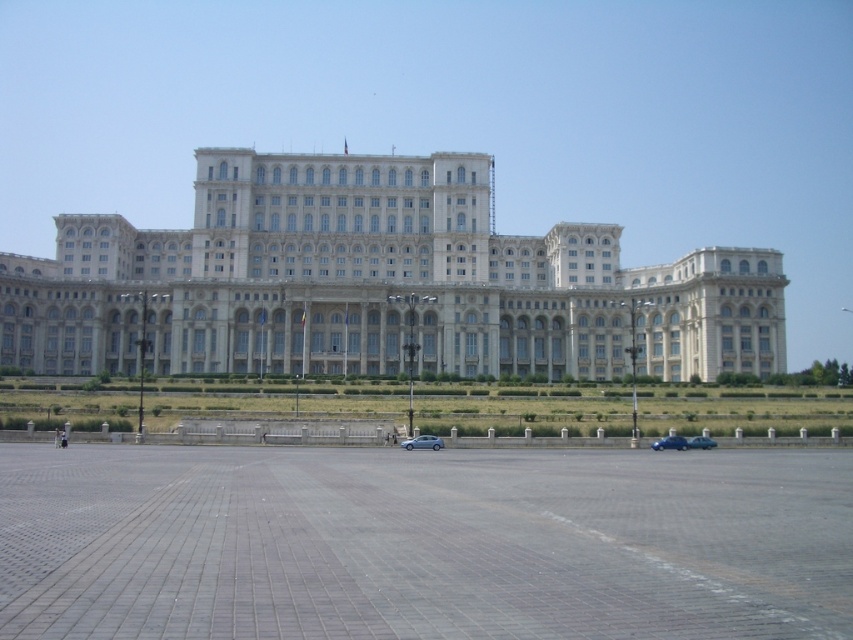
Question: Can you confirm if satin blue sedan at center is wider than blue metallic car at lower right?

Choices:
 (A) yes
 (B) no

Answer: (B)

Question: Which point is closer to the camera?

Choices:
 (A) teal glossy car at center
 (B) white stone building at center

Answer: (A)

Question: Which object appears farthest from the camera in this image?

Choices:
 (A) teal glossy car at center
 (B) white stone building at center

Answer: (B)

Question: Does satin blue sedan at center have a greater width compared to blue metallic car at lower right?

Choices:
 (A) yes
 (B) no

Answer: (B)

Question: In this image, where is satin blue sedan at center located relative to teal glossy car at center?

Choices:
 (A) above
 (B) below

Answer: (A)

Question: Which point is farther from the camera taking this photo?

Choices:
 (A) (498, 356)
 (B) (712, 445)

Answer: (A)